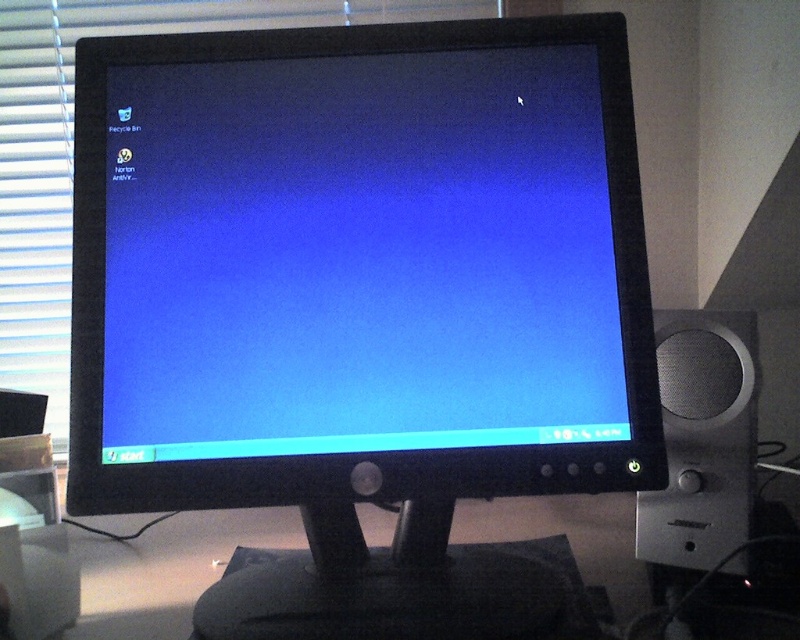
Between white matte blind at upper left and silver metallic speaker at right, which one appears on the right side from the viewer's perspective?

silver metallic speaker at right is more to the right.

Can you confirm if white matte blind at upper left is bigger than silver metallic speaker at right?

Correct, white matte blind at upper left is larger in size than silver metallic speaker at right.

Which is in front, point (40, 113) or point (724, 374)?

Point (724, 374) is in front.

Locate an element on the screen. white matte blind at upper left is located at coordinates (72, 148).

Who is higher up, black glossy monitor at center or white matte blind at upper left?

white matte blind at upper left is higher up.

Does point (389, 550) lie in front of point (114, 16)?

Yes, point (389, 550) is in front of point (114, 16).

Between point (314, 52) and point (28, 177), which one is positioned behind?

Point (28, 177)

At what (x,y) coordinates should I click in order to perform the action: click on black glossy monitor at center. Please return your answer as a coordinate pair (x, y). The image size is (800, 640). Looking at the image, I should click on (362, 305).

Which is behind, point (272, 579) or point (700, 509)?

The point (272, 579) is more distant.

Is black glossy monitor at center thinner than silver metallic speaker at right?

No.

You are a GUI agent. You are given a task and a screenshot of the screen. Output one action in this format:
    pyautogui.click(x=<x>, y=<y>)
    Task: Click on the black glossy monitor at center
    This screenshot has width=800, height=640.
    Given the screenshot: What is the action you would take?
    pyautogui.click(x=362, y=305)

This screenshot has width=800, height=640. I want to click on black glossy monitor at center, so click(x=362, y=305).